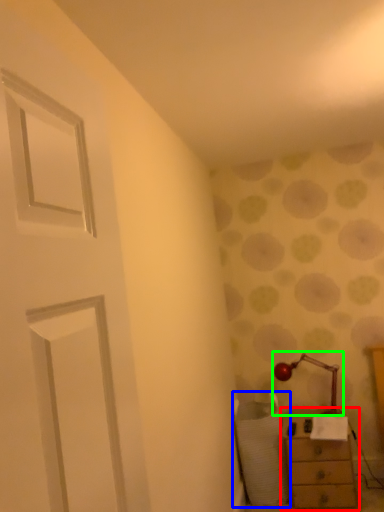
Question: Which is farther away from chest of drawers (highlighted by a red box)? swivel chair (highlighted by a blue box) or table lamp (highlighted by a green box)?

Choices:
 (A) swivel chair
 (B) table lamp

Answer: (B)